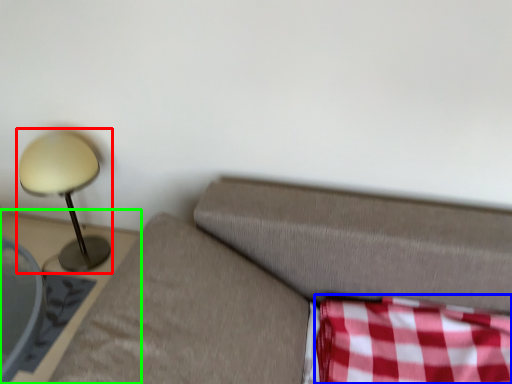
Question: Based on their relative distances, which object is nearer to lamp (highlighted by a red box)? Choose from plaid (highlighted by a blue box) and furniture (highlighted by a green box).

Choices:
 (A) plaid
 (B) furniture

Answer: (B)